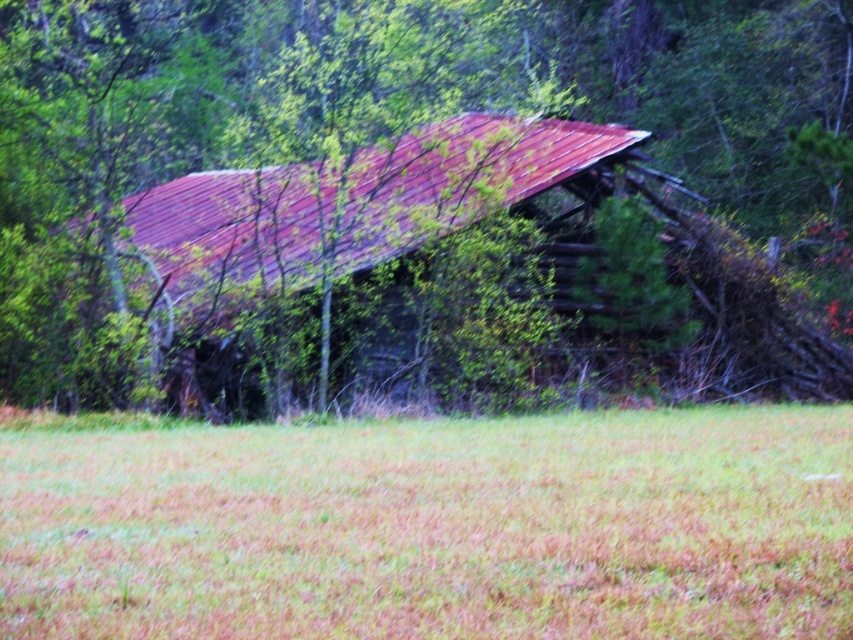
You are a maintenance worker assessing the abandoned structure. You notice the rusty metal roof at center and the brown dry grass at center. Which object is taller from the ground level?

The rusty metal roof at center is taller than the brown dry grass at center.

You are standing in front of the abandoned building and notice two points marked on the structure. The first point is at coordinates point (519, 145) and the second is at point (355, 600). Which point is closer to you?

Point (355, 600) is closer to you because it is less further to the camera than point (519, 145).